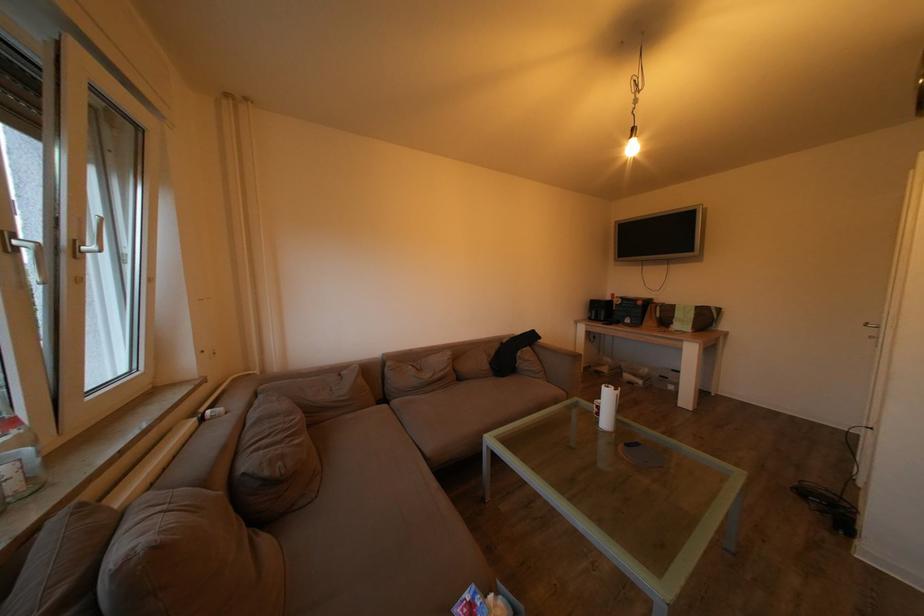
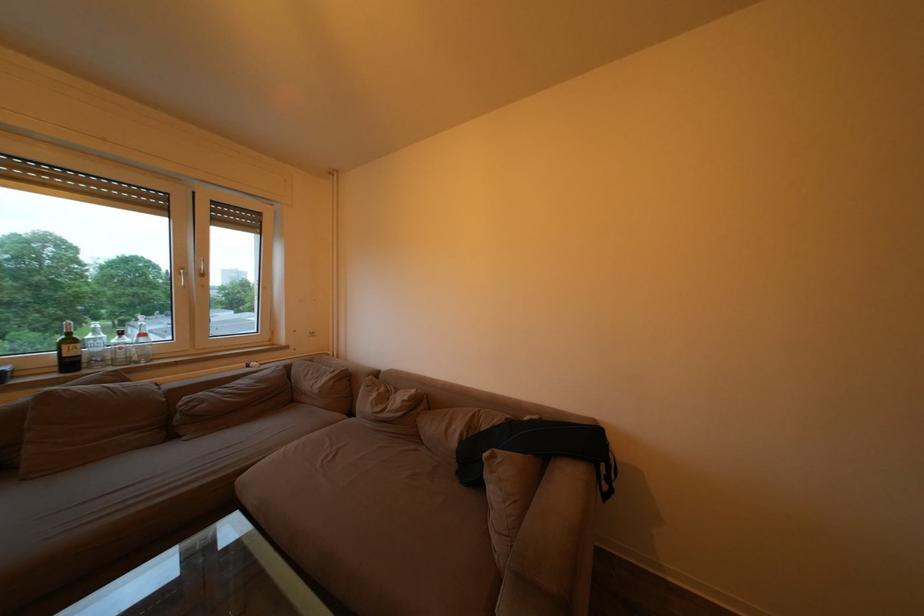
Find the pixel in the second image that matches the point at 493,371 in the first image.

(463, 448)